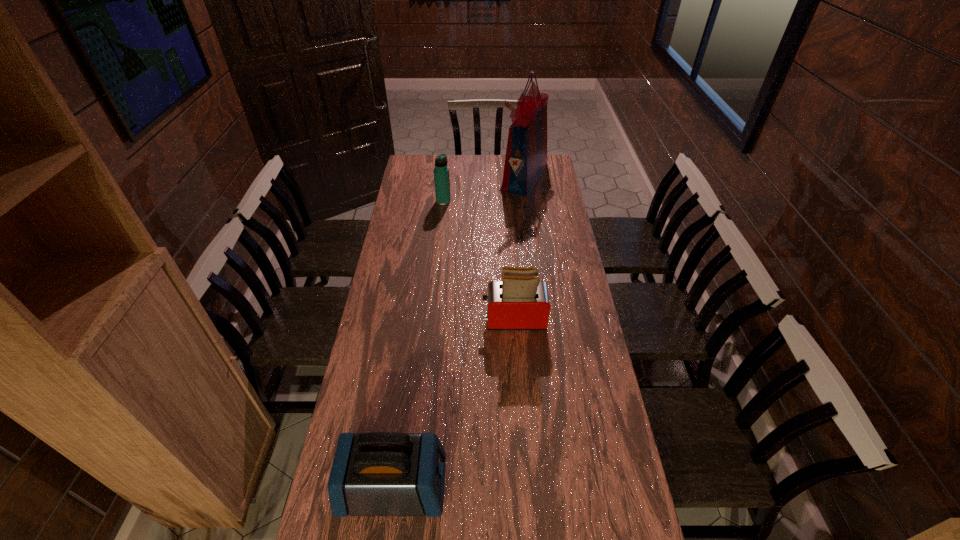
This screenshot has width=960, height=540. What are the coordinates of `free area in between the nearer toaster and the right toaster` in the screenshot? It's located at (454, 403).

Identify which object is located as the second nearest to the left toaster. Please provide its 2D coordinates. Your answer should be formatted as a tuple, i.e. [(x, y)], where the tuple contains the x and y coordinates of a point satisfying the conditions above.

[(441, 172)]

Where is `the second closest object to the tallest object`? This screenshot has height=540, width=960. the second closest object to the tallest object is located at coordinates (520, 301).

Locate an element on the screen. The width and height of the screenshot is (960, 540). vacant space that satisfies the following two spatial constraints: 1. on the front side of the thermos bottle; 2. on the front-facing side of the left toaster is located at coordinates (414, 487).

At what (x,y) coordinates should I click in order to perform the action: click on vacant space that satisfies the following two spatial constraints: 1. on the front side of the third nearest object; 2. on the front-facing side of the left toaster. Please return your answer as a coordinate pair (x, y). This screenshot has height=540, width=960. Looking at the image, I should click on (414, 487).